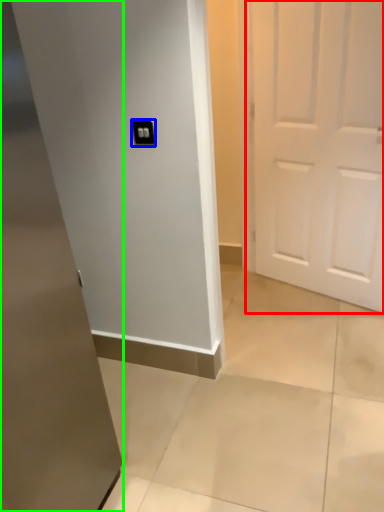
Question: Based on their relative distances, which object is nearer to door (highlighted by a red box)? Choose from light switch (highlighted by a blue box) and door (highlighted by a green box).

Choices:
 (A) light switch
 (B) door

Answer: (A)